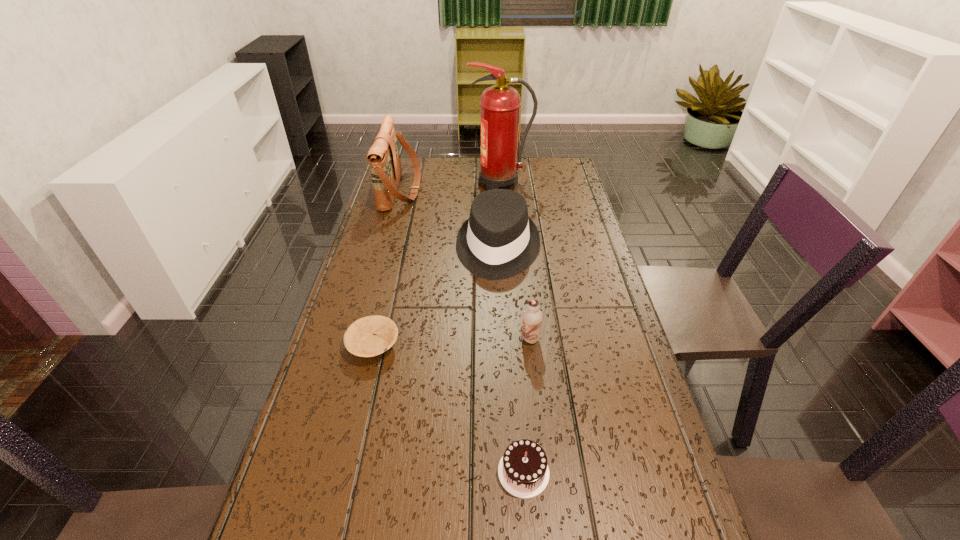
Locate an element on the screen. The image size is (960, 540). blank space located on the front-facing side of the tallest object is located at coordinates (448, 184).

The image size is (960, 540). Identify the location of free space located on the front-facing side of the second tallest object. (497, 190).

Find the location of a particular element. free spot located 0.120m on the left of the fourth nearest object is located at coordinates (418, 248).

Find the location of a particular element. Image resolution: width=960 pixels, height=540 pixels. free spot located on the right of the chocolate milk is located at coordinates (588, 339).

The width and height of the screenshot is (960, 540). In order to click on vacant space located 0.080m on the left of the nearest object in this screenshot , I will do `click(457, 472)`.

The height and width of the screenshot is (540, 960). Find the location of `free spot located 0.200m on the front of the shortest object`. free spot located 0.200m on the front of the shortest object is located at coordinates (349, 447).

At what (x,y) coordinates should I click in order to perform the action: click on fire extinguisher that is at the far edge. Please return your answer as a coordinate pair (x, y). Looking at the image, I should click on (500, 104).

Identify the location of shoulder bag positioned at the far edge. This screenshot has height=540, width=960. pos(384,158).

I want to click on shoulder bag at the left edge, so click(384, 158).

In order to click on bowl situated at the left edge in this screenshot , I will do `click(369, 336)`.